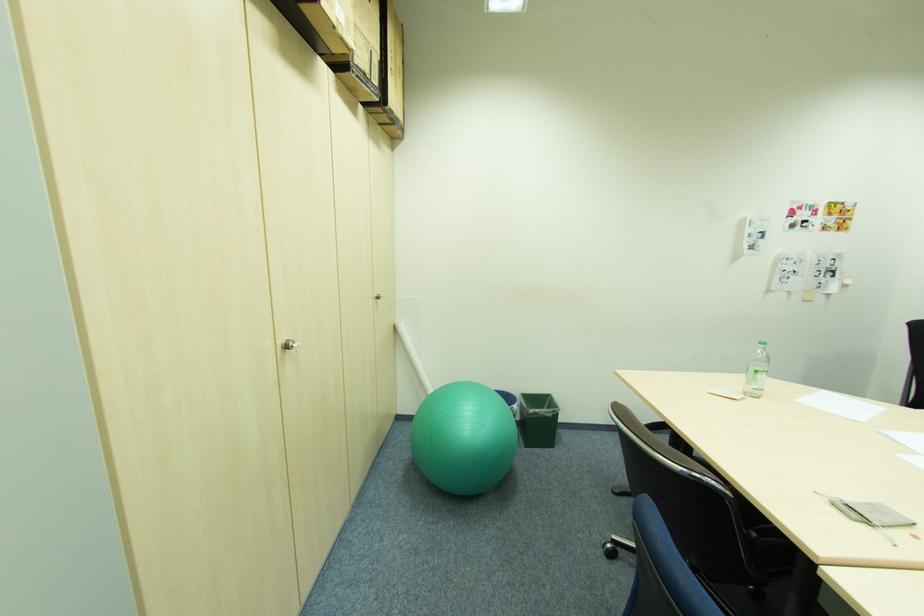
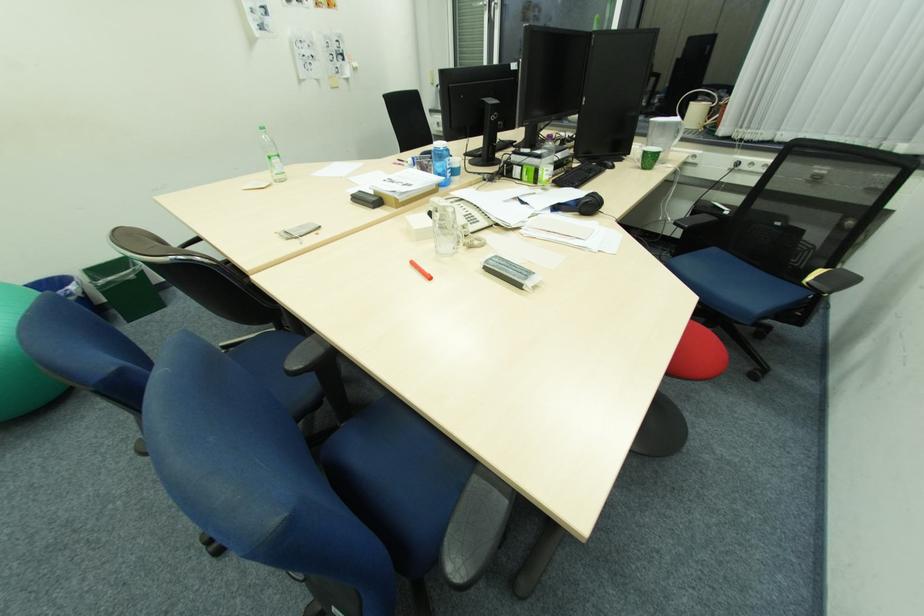
First-person continuous shooting, in which direction is the camera rotating?

The rotation direction of the camera is right-down.